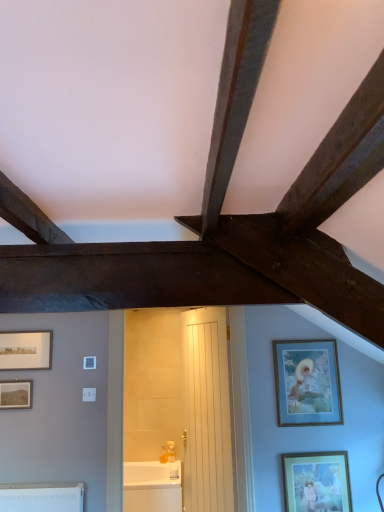
Question: Is white glossy bathtub at center at the left side of matte gold picture frame at lower right, acting as the fourth picture frame starting from the left?

Choices:
 (A) yes
 (B) no

Answer: (A)

Question: From a real-world perspective, is white glossy bathtub at center positioned under matte gold picture frame at lower right, which is the first picture frame in bottom-to-top order, based on gravity?

Choices:
 (A) yes
 (B) no

Answer: (A)

Question: Can matte gold picture frame at lower right, which is the 4th picture frame from top to bottom, be found inside white glossy bathtub at center?

Choices:
 (A) no
 (B) yes

Answer: (A)

Question: Is white glossy bathtub at center facing away from matte gold picture frame at lower right, which appears as the 1th picture frame when viewed from the right?

Choices:
 (A) no
 (B) yes

Answer: (A)

Question: From the image's perspective, is white glossy bathtub at center below matte gold picture frame at lower right, which appears as the 1th picture frame when viewed from the right?

Choices:
 (A) no
 (B) yes

Answer: (B)

Question: In terms of width, does matte gold picture frame at lower right, which is the first picture frame in bottom-to-top order, look wider or thinner when compared to matte brown picture frame at lower left, which is counted as the 3th picture frame, starting from the right?

Choices:
 (A) thin
 (B) wide

Answer: (B)

Question: From the image's perspective, is matte gold picture frame at lower right, which appears as the 1th picture frame when viewed from the right, positioned above or below matte brown picture frame at lower left, the second picture frame positioned from the bottom?

Choices:
 (A) above
 (B) below

Answer: (B)

Question: From a real-world perspective, relative to matte brown picture frame at lower left, the second picture frame positioned from the bottom, is matte gold picture frame at lower right, which is the first picture frame in bottom-to-top order, vertically above or below?

Choices:
 (A) below
 (B) above

Answer: (A)

Question: Choose the correct answer: Is matte gold picture frame at lower right, which is the first picture frame in bottom-to-top order, inside matte brown picture frame at lower left, placed as the 3th picture frame when sorted from top to bottom, or outside it?

Choices:
 (A) outside
 (B) inside

Answer: (A)

Question: Considering the positions of white wooden door at center and matte gold picture frame at lower right, which appears as the 1th picture frame when viewed from the right, in the image, is white wooden door at center taller or shorter than matte gold picture frame at lower right, which appears as the 1th picture frame when viewed from the right,?

Choices:
 (A) short
 (B) tall

Answer: (B)

Question: Do you think white wooden door at center is within matte gold picture frame at lower right, which is the first picture frame in bottom-to-top order, or outside of it?

Choices:
 (A) outside
 (B) inside

Answer: (A)

Question: From a real-world perspective, is white wooden door at center physically located above or below matte gold picture frame at lower right, acting as the fourth picture frame starting from the left?

Choices:
 (A) below
 (B) above

Answer: (B)

Question: In terms of size, does white wooden door at center appear bigger or smaller than matte gold picture frame at lower right, acting as the fourth picture frame starting from the left?

Choices:
 (A) small
 (B) big

Answer: (B)

Question: Is matte silver picture frame at left, the fourth picture frame from the right, bigger or smaller than matte brown picture frame at lower left, placed as the 3th picture frame when sorted from top to bottom?

Choices:
 (A) big
 (B) small

Answer: (A)

Question: From a real-world perspective, is matte silver picture frame at left, the fourth picture frame from the right, positioned above or below matte brown picture frame at lower left, acting as the second picture frame starting from the left?

Choices:
 (A) above
 (B) below

Answer: (A)